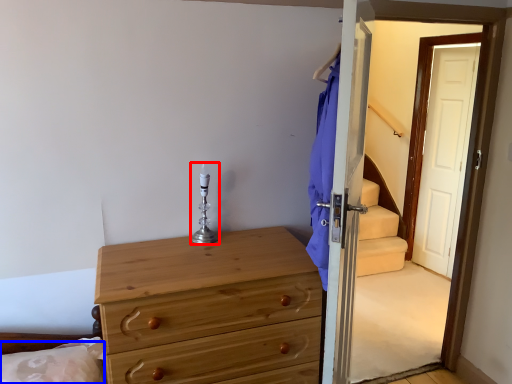
Question: Among these objects, which one is farthest to the camera, candle holder (highlighted by a red box) or pillow (highlighted by a blue box)?

Choices:
 (A) candle holder
 (B) pillow

Answer: (A)